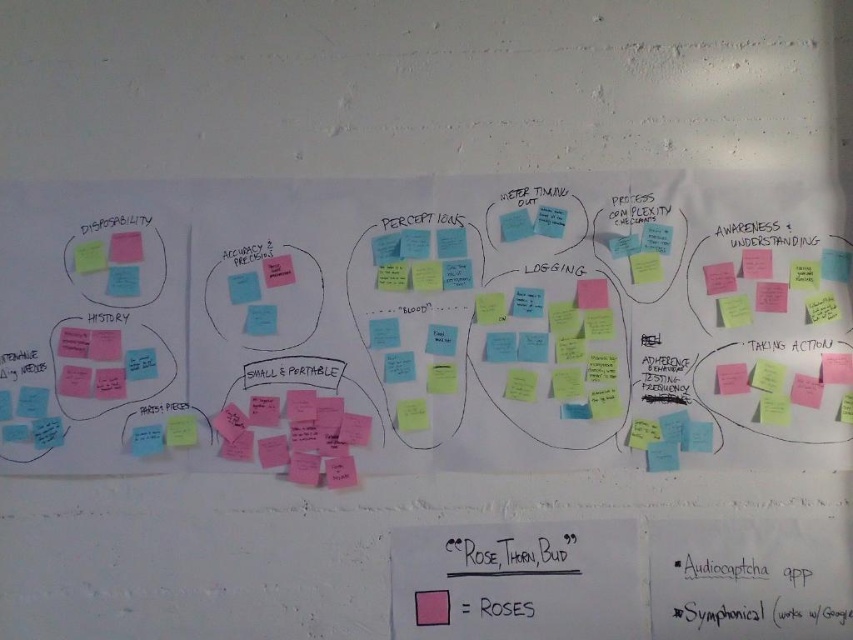
You are organizing a meeting and need to place a new sticky note on the whiteboard. You have to decide between placing it above or below the pink matte sticky note at upper left and the green matte sticky note at upper left. Based on their sizes, which direction should you choose?

The pink matte sticky note at upper left is shorter than the green matte sticky note at upper left. To place the new sticky note without overlapping, you should position it below the taller green matte sticky note at upper left since it has more vertical space available.